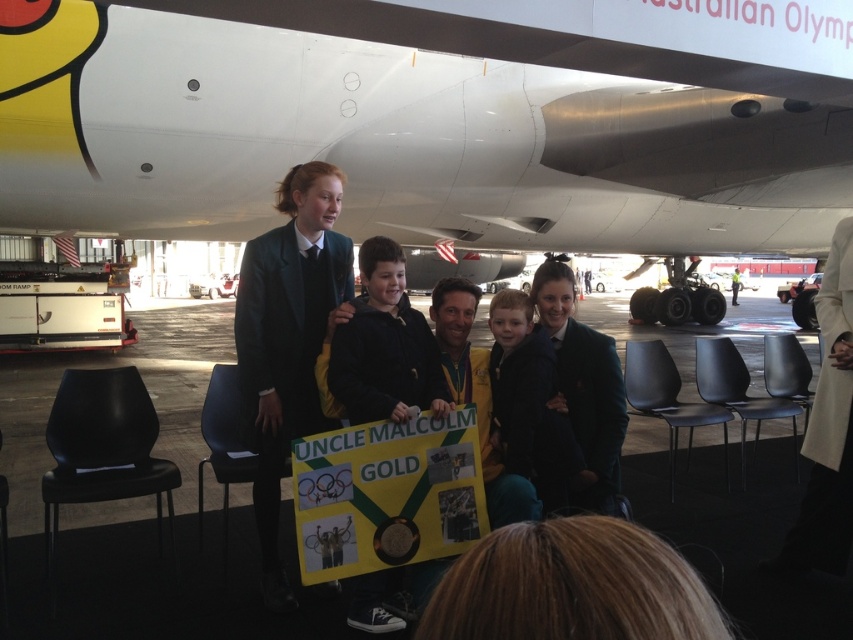
You are a photographer standing at the back of the group. You want to take a photo of both the dark blue jacket at center and the black woolen blazer at center so that both are clearly visible. Given that your camera has a minimum focus distance of 8 inches, will you be able to capture both items in focus without moving closer?

The dark blue jacket at center and black woolen blazer at center are 8.21 inches apart from each other. Since the minimum focus distance is 8 inches, the 8.21 inch separation is slightly beyond the minimum requirement, so the camera should be able to focus on both items without moving closer.

You are a photographer at the scene and want to ensure both the matte black suit at center and the dark blue jacket at center are clearly visible in your photo. Which one might you need to adjust your focus on to ensure it stands out more due to its size?

The matte black suit at center is larger in size than the dark blue jacket at center, so you might need to adjust focus on the dark blue jacket at center to ensure it stands out more against the larger suit.